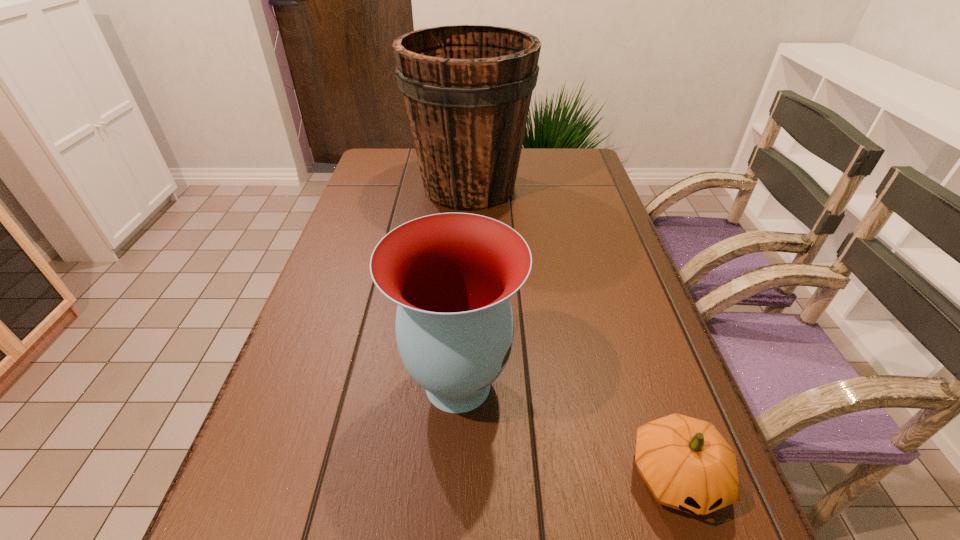
Where is `object present at the far left corner`? object present at the far left corner is located at coordinates (467, 89).

You are a GUI agent. You are given a task and a screenshot of the screen. Output one action in this format:
    pyautogui.click(x=<x>, y=<y>)
    Task: Click on the blank space at the left edge of the desktop
    Image resolution: width=960 pixels, height=540 pixels.
    Given the screenshot: What is the action you would take?
    pyautogui.click(x=360, y=231)

Image resolution: width=960 pixels, height=540 pixels. In the image, there is a desktop. What are the coordinates of `vacant space at the right edge` in the screenshot? It's located at (617, 344).

In the image, there is a desktop. Identify the location of free space at the far left corner. (364, 175).

Identify the location of vacant space at the far right corner of the desktop. (582, 171).

Where is `free space between the rightmost object and the second shortest object`? free space between the rightmost object and the second shortest object is located at coordinates (567, 430).

At what (x,y) coordinates should I click in order to perform the action: click on free space between the vase and the gourd. Please return your answer as a coordinate pair (x, y). The width and height of the screenshot is (960, 540). Looking at the image, I should click on (567, 430).

Image resolution: width=960 pixels, height=540 pixels. What are the coordinates of `free space between the rightmost object and the tallest object` in the screenshot? It's located at (573, 332).

This screenshot has height=540, width=960. In order to click on unoccupied area between the shortest object and the bucket in this screenshot , I will do `click(573, 332)`.

Point out which object is positioned as the nearest to the bucket. Please provide its 2D coordinates. Your answer should be formatted as a tuple, i.e. [(x, y)], where the tuple contains the x and y coordinates of a point satisfying the conditions above.

[(452, 274)]